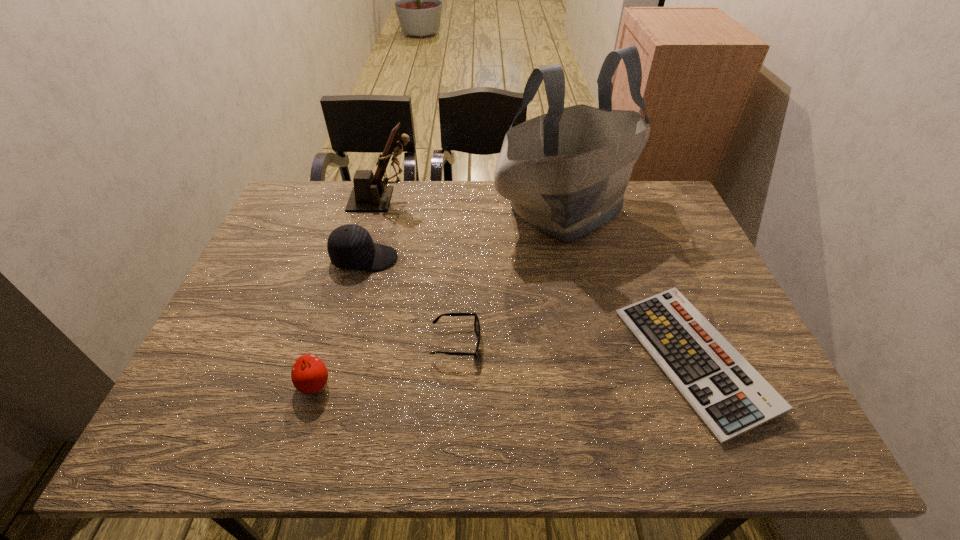
Identify the location of vacant region between the fourth tallest object and the fourth shortest object. (340, 321).

You are a GUI agent. You are given a task and a screenshot of the screen. Output one action in this format:
    pyautogui.click(x=<x>, y=<y>)
    Task: Click on the blank region between the figurine and the apple
    Image resolution: width=960 pixels, height=540 pixels.
    Given the screenshot: What is the action you would take?
    pyautogui.click(x=348, y=292)

In order to click on vacant space that is in between the shortest object and the fourth tallest object in this screenshot , I will do `click(504, 372)`.

The width and height of the screenshot is (960, 540). What are the coordinates of `empty location between the second tallest object and the shortest object` in the screenshot? It's located at (539, 279).

At what (x,y) coordinates should I click in order to perform the action: click on vacant point located between the computer keyboard and the tallest object. Please return your answer as a coordinate pair (x, y). The image size is (960, 540). Looking at the image, I should click on (628, 285).

The height and width of the screenshot is (540, 960). Find the location of `free space between the computer keyboard and the shopping bag`. free space between the computer keyboard and the shopping bag is located at coordinates (628, 285).

Locate which object ranks second in proximity to the apple. Please provide its 2D coordinates. Your answer should be formatted as a tuple, i.e. [(x, y)], where the tuple contains the x and y coordinates of a point satisfying the conditions above.

[(350, 247)]

Identify which object is the closest to the tallest object. Please provide its 2D coordinates. Your answer should be formatted as a tuple, i.e. [(x, y)], where the tuple contains the x and y coordinates of a point satisfying the conditions above.

[(727, 393)]

Where is `vacant space that satisfies the following two spatial constraints: 1. at the front of the computer keyboard where the brim is located; 2. on the left side of the fourth shortest object`? Image resolution: width=960 pixels, height=540 pixels. vacant space that satisfies the following two spatial constraints: 1. at the front of the computer keyboard where the brim is located; 2. on the left side of the fourth shortest object is located at coordinates (337, 360).

Where is `free space that satisfies the following two spatial constraints: 1. at the front of the computer keyboard where the brim is located; 2. on the right side of the third tallest object`? The image size is (960, 540). free space that satisfies the following two spatial constraints: 1. at the front of the computer keyboard where the brim is located; 2. on the right side of the third tallest object is located at coordinates (337, 360).